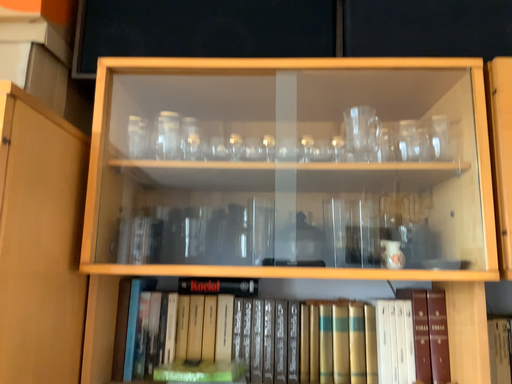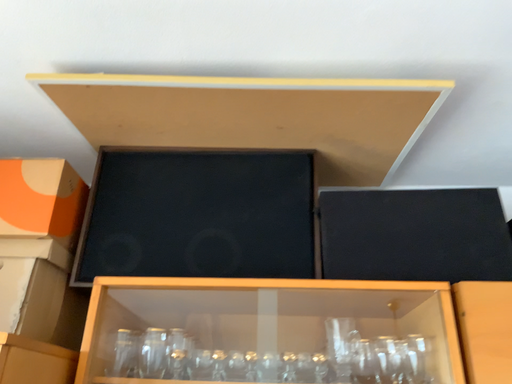
Question: Which way did the camera rotate in the video?

Choices:
 (A) rotated downward
 (B) rotated upward

Answer: (B)